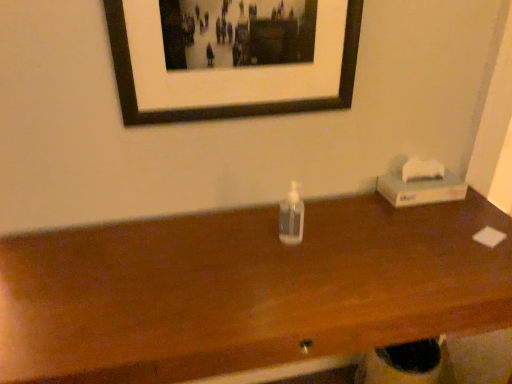
You are a GUI agent. You are given a task and a screenshot of the screen. Output one action in this format:
    pyautogui.click(x=<x>, y=<y>)
    Task: Click on the free space in front of transparent plastic bottle at center
    This screenshot has width=512, height=384.
    Given the screenshot: What is the action you would take?
    pyautogui.click(x=293, y=278)